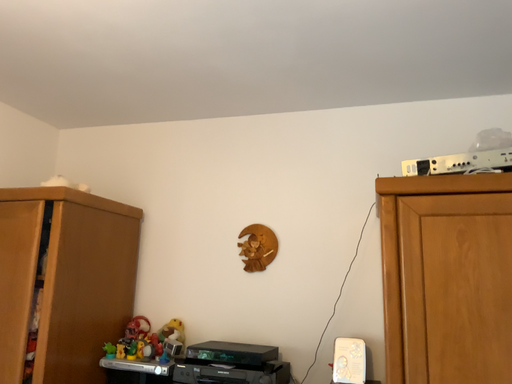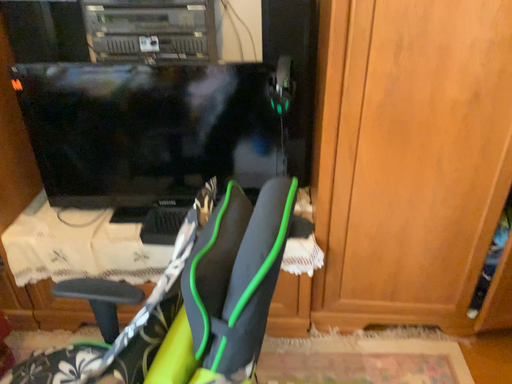
Question: Which way did the camera rotate in the video?

Choices:
 (A) rotated upward
 (B) rotated downward

Answer: (B)